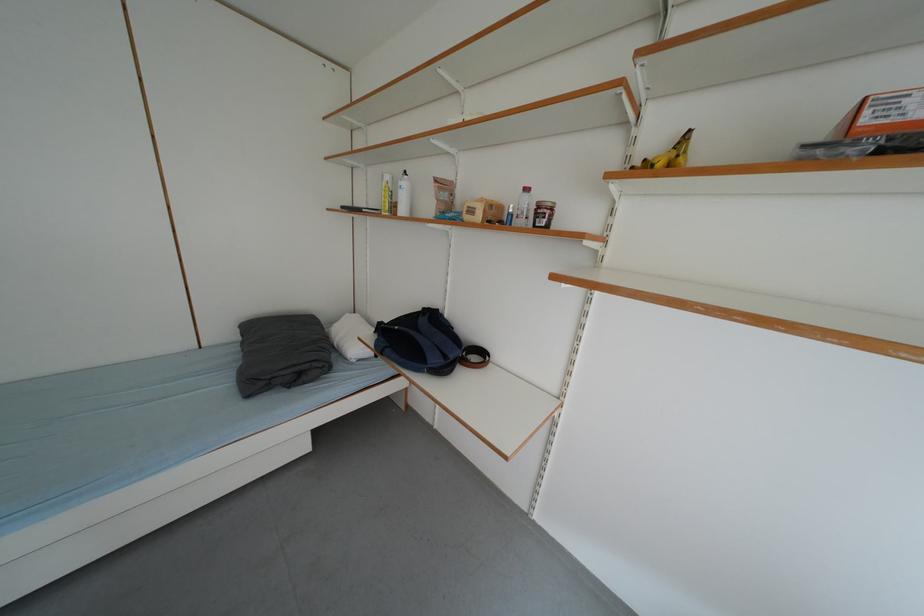
Locate an element on the screen. brown paper bag is located at coordinates (482, 211).